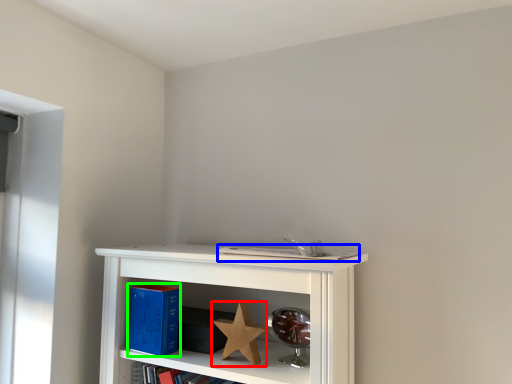
Question: Estimate the real-world distances between objects in this image. Which object is closer to star (highlighted by a red box), book (highlighted by a blue box) or paperback book (highlighted by a green box)?

Choices:
 (A) book
 (B) paperback book

Answer: (B)